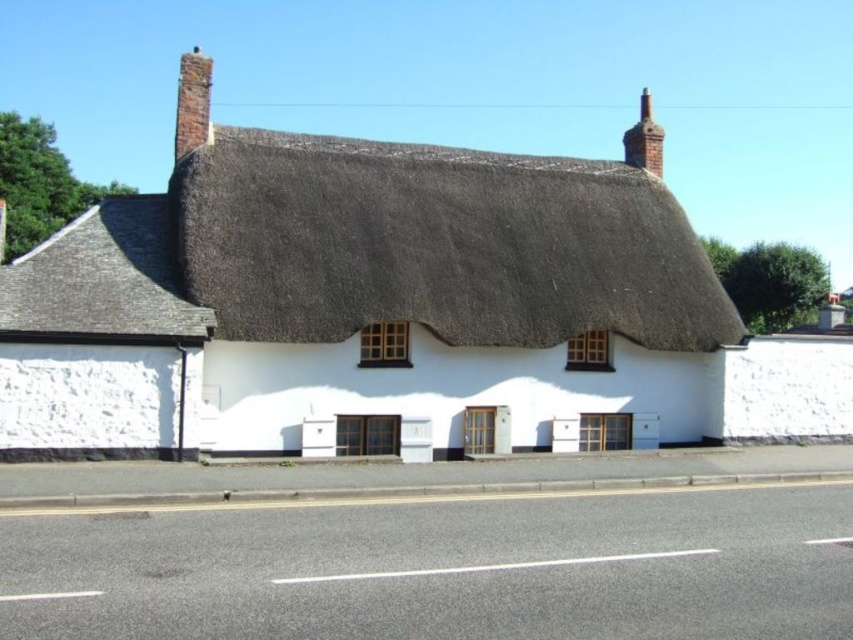
You are a delivery person approaching the thatched cottage and need to deliver a package to the left chimney. Which chimney should you head towards? The brick chimney at upper left or the red brick chimney at upper right?

The brick chimney at upper left is positioned on the left side of red brick chimney at upper right, so you should head towards the brick chimney at upper left.

You are a painter standing at the edge of the road and want to paint the white thatched roof cottage at center and the brown thatch roof at center. Since you have a limited amount of paint, you need to know which roof is closer to you to prioritize. Based on the scene description, which roof is closer?

The white thatched roof cottage at center is closer to you because it is 15.67 inches from the brown thatch roof at center, implying that the white roof is in front of the brown one.